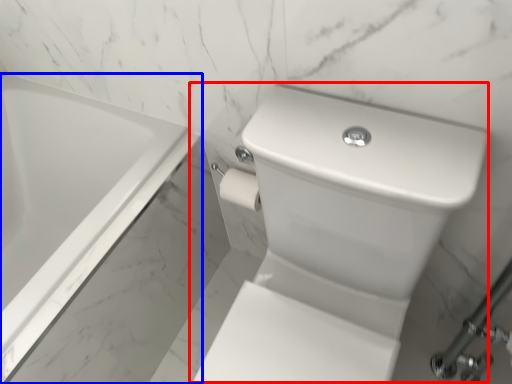
Question: Which point is further to the camera, sink (highlighted by a red box) or bathtub (highlighted by a blue box)?

Choices:
 (A) sink
 (B) bathtub

Answer: (B)